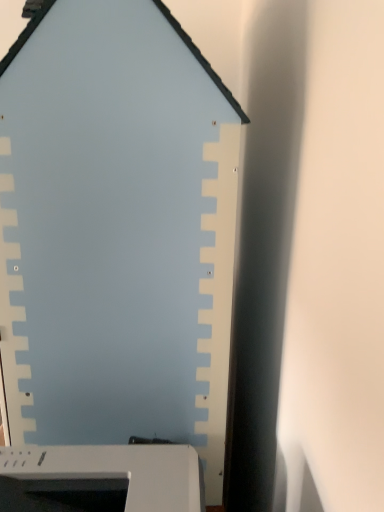
What do you see at coordinates (114, 260) in the screenshot? This screenshot has width=384, height=512. I see `light blue matte board at center` at bounding box center [114, 260].

At what (x,y) coordinates should I click in order to perform the action: click on light blue matte board at center. Please return your answer as a coordinate pair (x, y). Looking at the image, I should click on (114, 260).

What is the approximate height of light blue matte board at center?

light blue matte board at center is 33.33 inches tall.

Where is `light blue matte board at center`? Image resolution: width=384 pixels, height=512 pixels. light blue matte board at center is located at coordinates (114, 260).